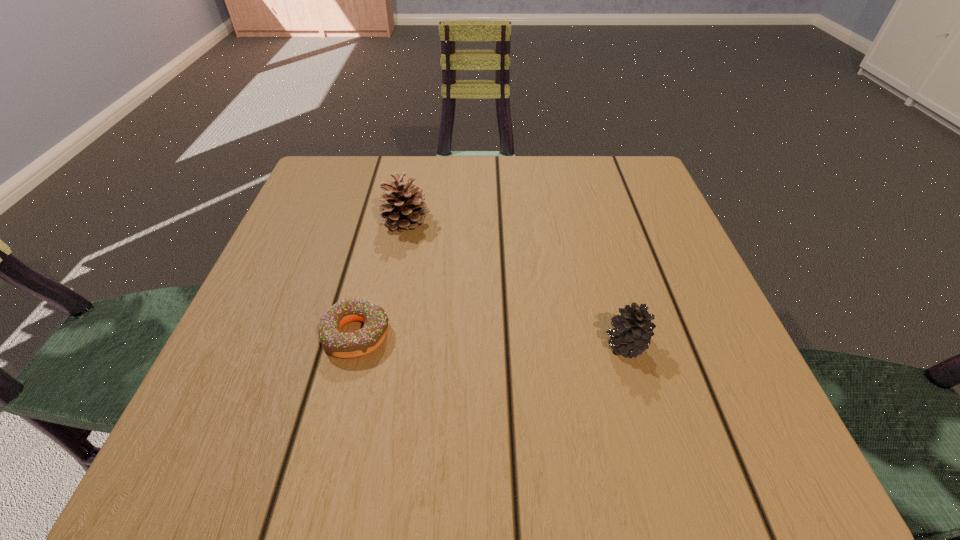
The image size is (960, 540). What are the coordinates of `free space between the shorter pinecone and the doughnut` in the screenshot? It's located at (492, 339).

I want to click on free point between the taller pinecone and the shortest object, so tap(381, 278).

Identify the location of empty space that is in between the second tallest object and the taller pinecone. Image resolution: width=960 pixels, height=540 pixels. point(516,282).

Where is `free area in between the shorter pinecone and the farthest object`? free area in between the shorter pinecone and the farthest object is located at coordinates (x=516, y=282).

I want to click on vacant area between the shortest object and the second tallest object, so click(x=492, y=339).

This screenshot has height=540, width=960. I want to click on free space between the rightmost object and the doughnut, so click(x=492, y=339).

This screenshot has height=540, width=960. I want to click on free space between the taller pinecone and the second tallest object, so click(x=516, y=282).

Where is `unoccupied area between the shortest object and the second tallest object`? unoccupied area between the shortest object and the second tallest object is located at coordinates (492, 339).

Identify which object is the second closest to the taller pinecone. Please provide its 2D coordinates. Your answer should be formatted as a tuple, i.e. [(x, y)], where the tuple contains the x and y coordinates of a point satisfying the conditions above.

[(633, 330)]

Image resolution: width=960 pixels, height=540 pixels. Find the location of `the closest object to the doughnut`. the closest object to the doughnut is located at coordinates (406, 210).